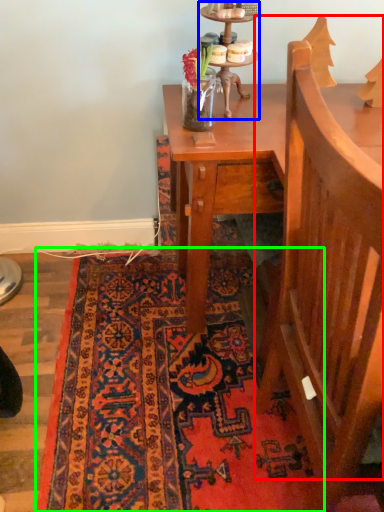
Question: Which object is positioned farthest from armchair (highlighted by a red box)? Select from candle holder (highlighted by a blue box) and mat (highlighted by a green box).

Choices:
 (A) candle holder
 (B) mat

Answer: (A)